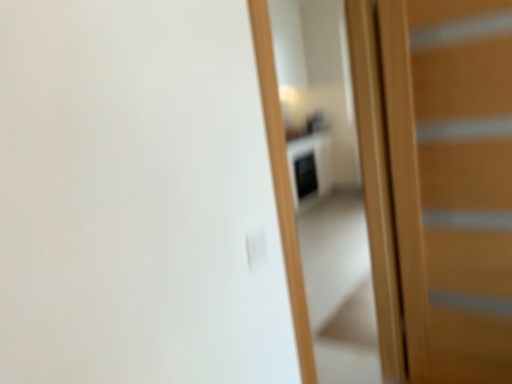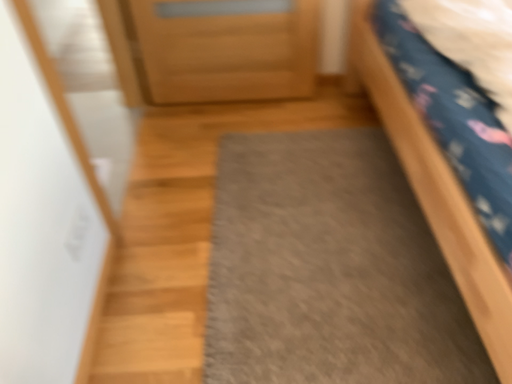
Question: Which way did the camera rotate in the video?

Choices:
 (A) rotated left
 (B) rotated right

Answer: (B)